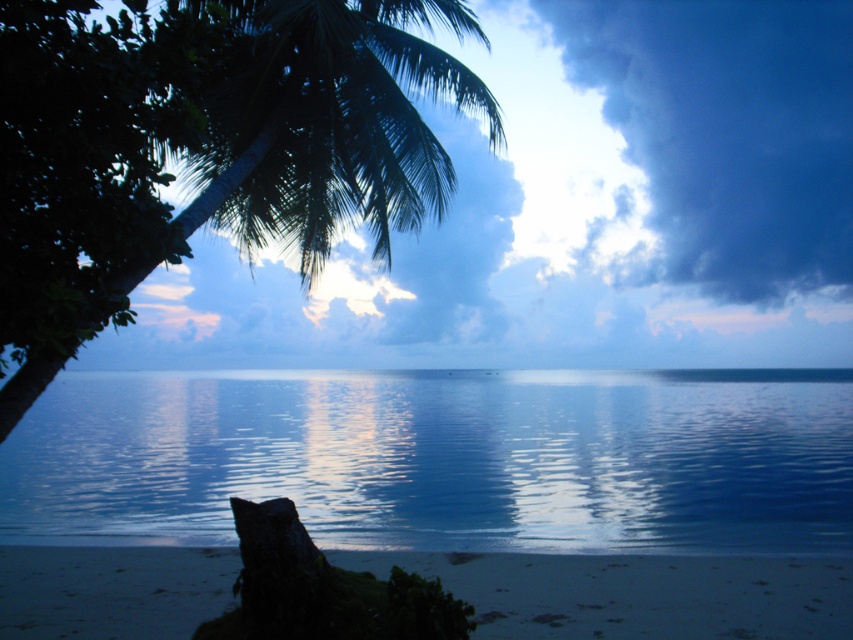
You are standing on the sandy beach at lower center and want to reach the smooth blue water at center. Which direction should you walk to get there?

You should walk forward towards the smooth blue water at center because it is taller than the sandy beach at lower center, meaning it is elevated or higher in position.

Based on the photo, you are a photographer wanting to capture the green leafy palm at upper left and the sandy beach at lower center in a single frame. Which object will appear taller in the photo?

The green leafy palm at upper left will appear taller in the photo since it has a greater height compared to the sandy beach at lower center.